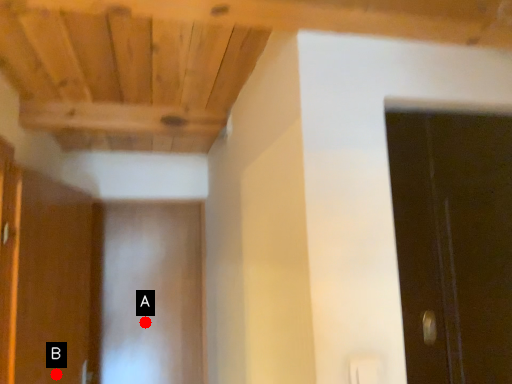
Question: Two points are circled on the image, labeled by A and B beside each circle. Which point is closer to the camera?

Choices:
 (A) A is closer
 (B) B is closer

Answer: (B)